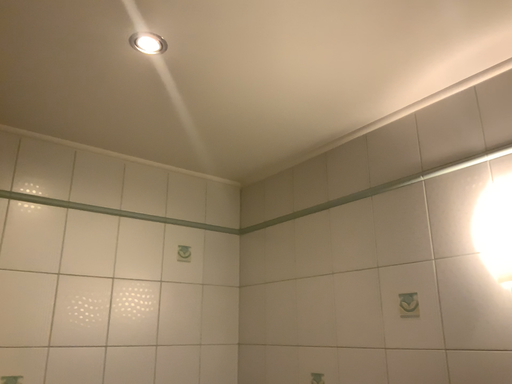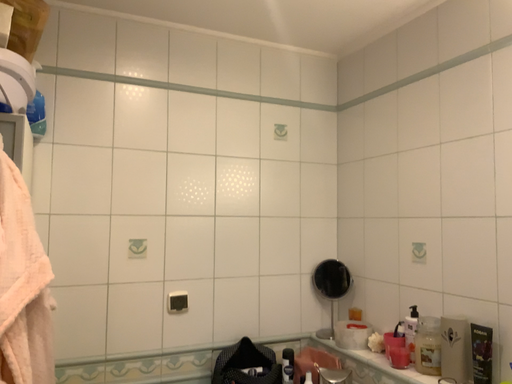
Question: How did the camera likely rotate when shooting the video?

Choices:
 (A) rotated left
 (B) rotated right

Answer: (A)